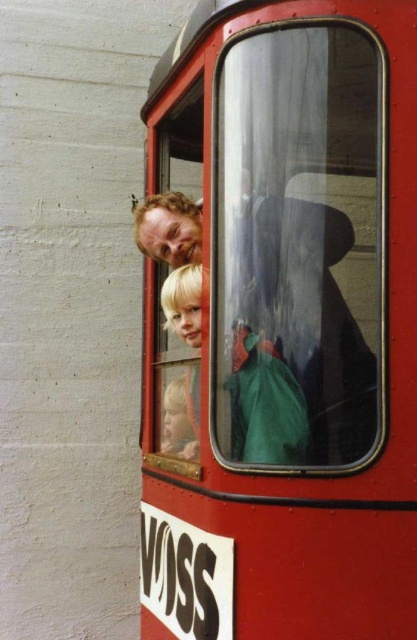
You are a passenger on the tram and want to take a photo of the blonde hair child at center without including the metallic red train car at center in the frame. Is this possible given their positions?

The metallic red train car at center is positioned over the blonde hair child at center, so taking a photo without including the train car would be difficult as it blocks the view of the child.

You are a photographer trying to capture a photo of the metallic red train car at center and the blonde hair child at center through the tram window. Based on their sizes, which one would appear bigger in your photo?

The metallic red train car at center appears bigger in the photo because its width is larger than the blonde hair child at center.

Based on the scene description, where is the metallic red train car at center located in the image? Please provide the coordinates in the format of a point like this example format for reference only, not part of the answer. Answer with the exact coordinates from the Objects Description.

The metallic red train car at center is located at point (283, 323).